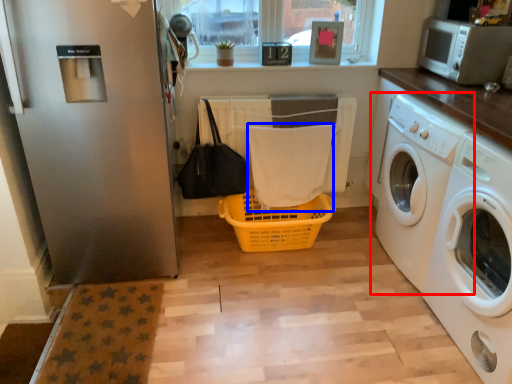
Question: Which object appears closest to the camera in this image, washing machine (highlighted by a red box) or bath towel (highlighted by a blue box)?

Choices:
 (A) washing machine
 (B) bath towel

Answer: (A)